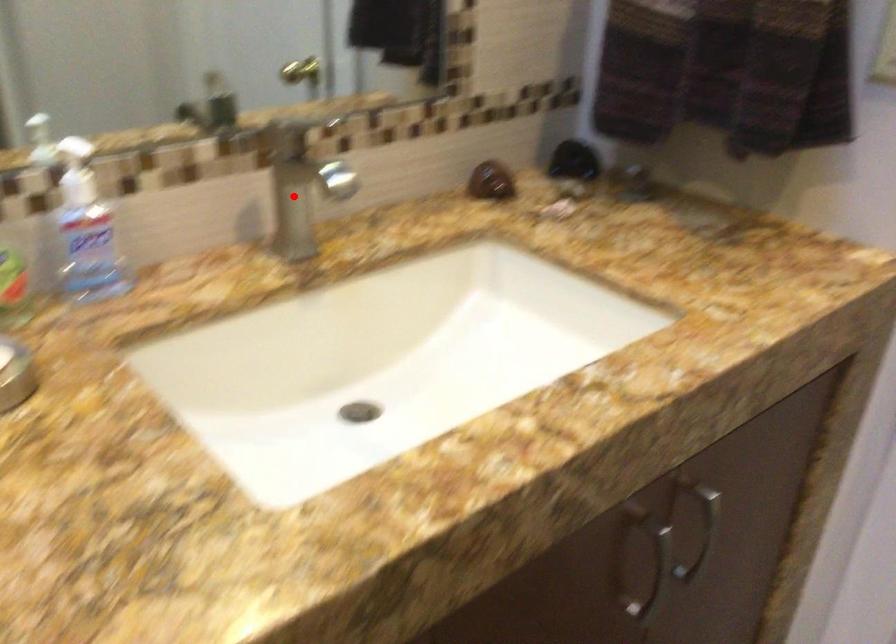
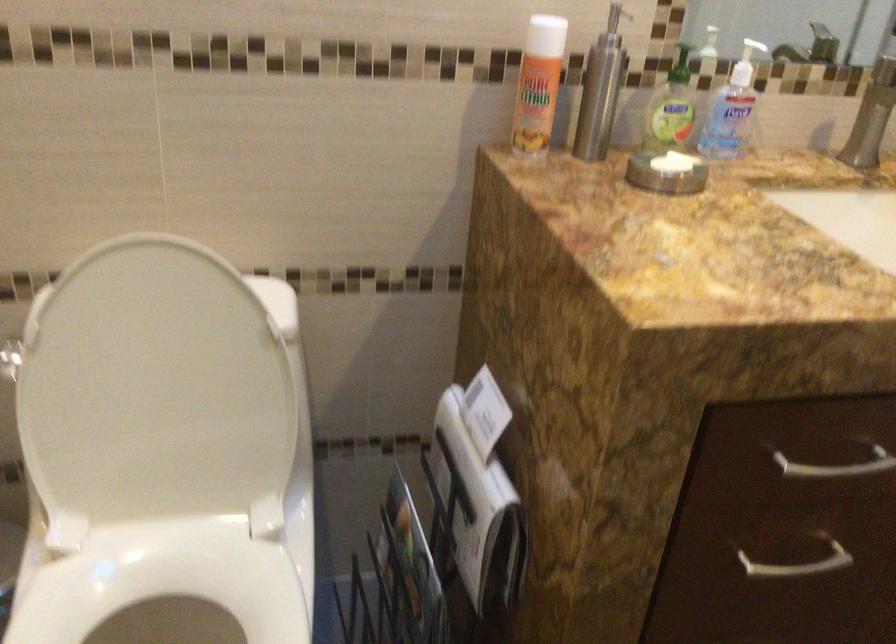
Question: I am providing you with two images of the same scene from different viewpoints. A red point is shown in image1. For the corresponding object point in image2, is it positioned nearer or farther from the camera?

Choices:
 (A) Nearer
 (B) Farther

Answer: (B)